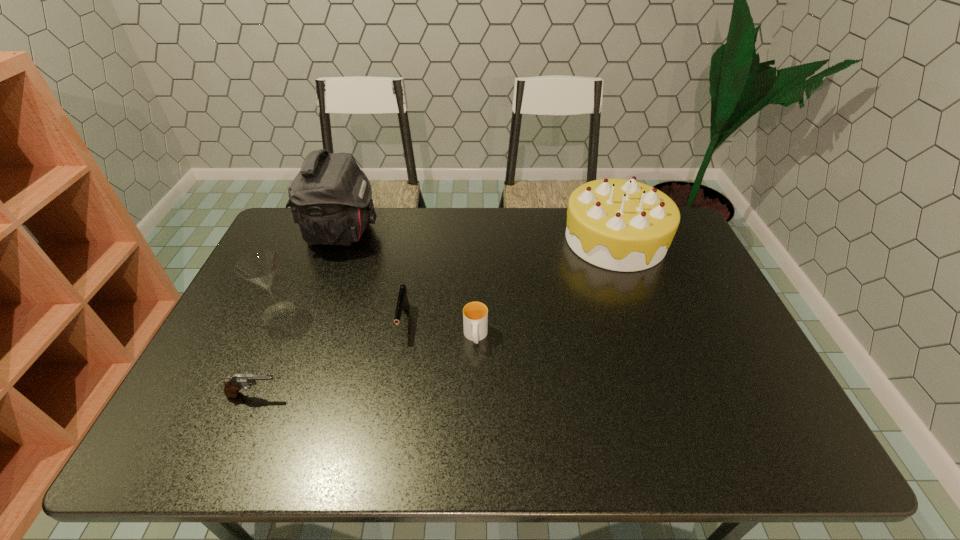
Identify the location of free space that satisfies the following two spatial constraints: 1. with the handle on the side of the cup; 2. at the barrel of the nearest object. The image size is (960, 540). (475, 395).

This screenshot has width=960, height=540. I want to click on vacant area in the image that satisfies the following two spatial constraints: 1. with the handle on the side of the fifth object from left to right; 2. at the barrel of the left pistol, so click(x=475, y=395).

Find the location of a particular element. blank space that satisfies the following two spatial constraints: 1. at the muzzle of the fourth object from left to right; 2. at the barrel of the nearer pistol is located at coordinates [x=392, y=395].

This screenshot has height=540, width=960. I want to click on free point that satisfies the following two spatial constraints: 1. with the handle on the side of the fifth object from left to right; 2. at the barrel of the nearest object, so click(475, 395).

What are the coordinates of `free region that satisfies the following two spatial constraints: 1. at the muzzle of the farther pistol; 2. at the barrel of the left pistol` in the screenshot? It's located at (392, 395).